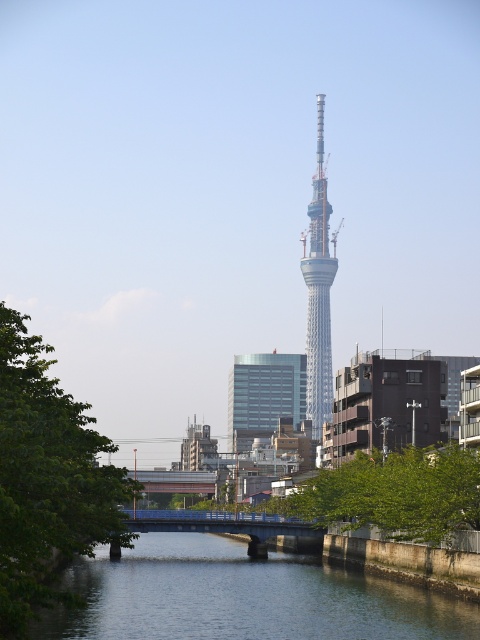
Question: Which object is the farthest from the green leafy tree at lower left?

Choices:
 (A) clear water at center
 (B) silver metallic tower at center

Answer: (B)

Question: Does clear water at center appear over green leafy tree at lower left?

Choices:
 (A) yes
 (B) no

Answer: (B)

Question: Estimate the real-world distances between objects in this image. Which object is farther from the green leafy tree at lower left?

Choices:
 (A) silver metallic tower at center
 (B) clear water at center

Answer: (A)

Question: Is green leafy tree at lower left above silver metallic tower at center?

Choices:
 (A) yes
 (B) no

Answer: (B)

Question: Is clear water at center below silver metallic tower at center?

Choices:
 (A) yes
 (B) no

Answer: (A)

Question: Estimate the real-world distances between objects in this image. Which object is farther from the green leafy tree at lower left?

Choices:
 (A) clear water at center
 (B) silver metallic tower at center

Answer: (B)